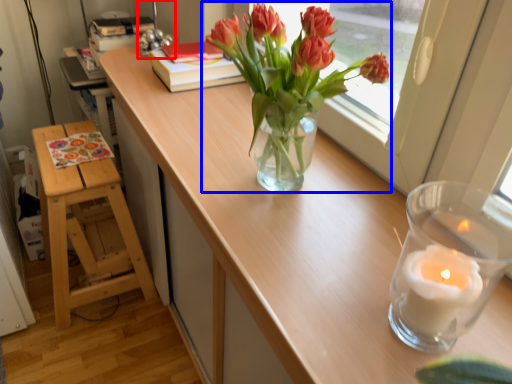
Question: Which of the following is the closest to the observer, table lamp (highlighted by a red box) or houseplant (highlighted by a blue box)?

Choices:
 (A) table lamp
 (B) houseplant

Answer: (B)